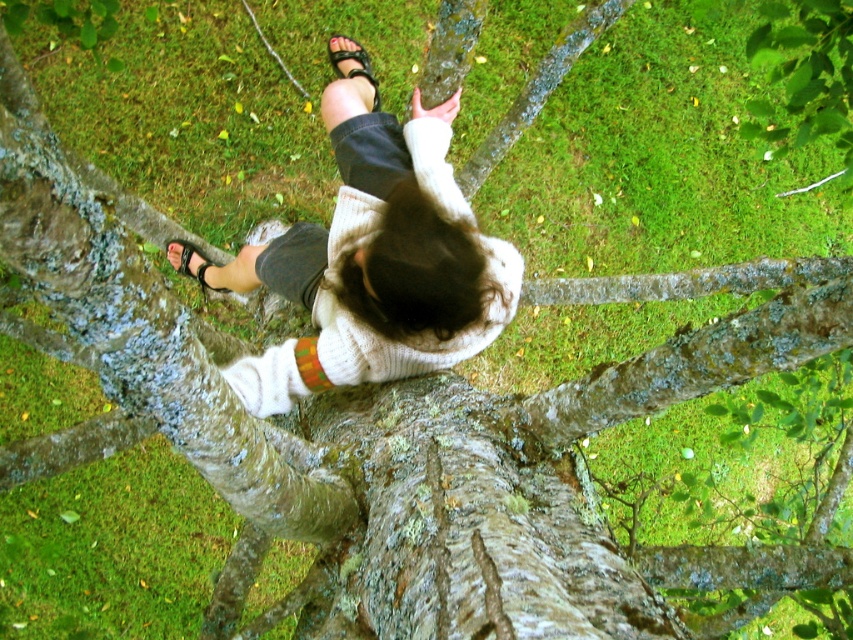
Question: In this image, where is white knitted sweater at center located relative to black leather sandal at center?

Choices:
 (A) below
 (B) above

Answer: (A)

Question: Which point is closer to the camera?

Choices:
 (A) black leather sandal at lower left
 (B) white knitted sweater at center

Answer: (B)

Question: Can you confirm if black leather sandal at center is wider than black leather sandal at lower left?

Choices:
 (A) no
 (B) yes

Answer: (A)

Question: In this image, where is black leather sandal at center located relative to black leather sandal at lower left?

Choices:
 (A) left
 (B) right

Answer: (B)

Question: Considering the real-world distances, which object is farthest from the white knitted sweater at center?

Choices:
 (A) black leather sandal at center
 (B) black leather sandal at lower left

Answer: (B)

Question: Which is farther from the black leather sandal at lower left?

Choices:
 (A) white knitted sweater at center
 (B) black leather sandal at center

Answer: (B)